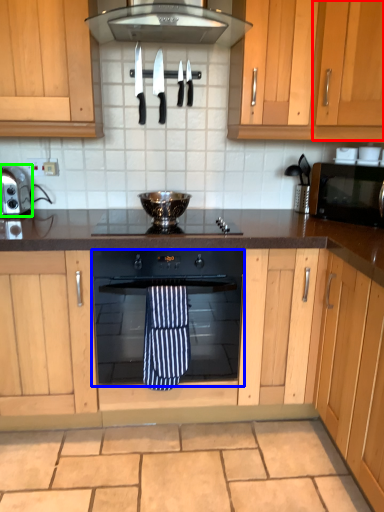
Question: Which object is the closest to the cabinetry (highlighted by a red box)? Choose among these: oven (highlighted by a blue box) or kitchen appliance (highlighted by a green box).

Choices:
 (A) oven
 (B) kitchen appliance

Answer: (A)